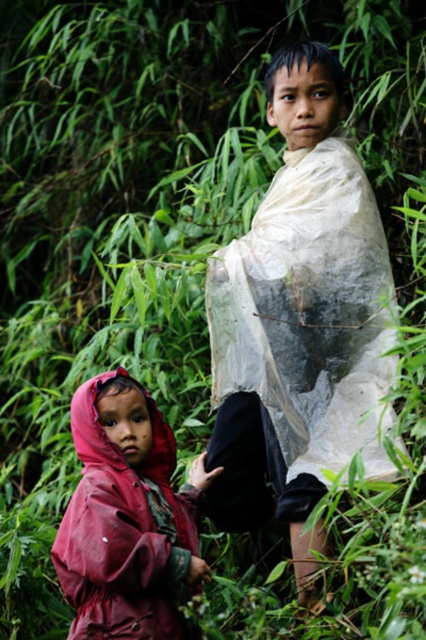
Question: Among these points, which one is nearest to the camera?

Choices:
 (A) (259, 472)
 (B) (189, 497)

Answer: (B)

Question: In this image, where is white plastic bag at center located relative to rubberized red raincoat at lower left?

Choices:
 (A) left
 (B) right

Answer: (B)

Question: From the image, what is the correct spatial relationship of white plastic bag at center in relation to rubberized red raincoat at lower left?

Choices:
 (A) left
 (B) right

Answer: (B)

Question: Which point is farther from the camera taking this photo?

Choices:
 (A) (267, 472)
 (B) (135, 582)

Answer: (A)

Question: Can you confirm if white plastic bag at center is positioned below rubberized red raincoat at lower left?

Choices:
 (A) no
 (B) yes

Answer: (A)